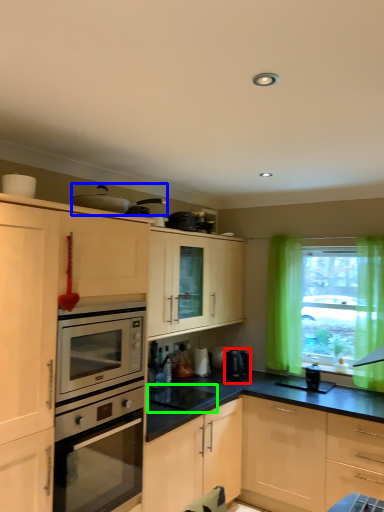
Question: Based on their relative distances, which object is nearer to coffee machine (highlighted by a red box)? Choose from appliance (highlighted by a blue box) and appliance (highlighted by a green box).

Choices:
 (A) appliance
 (B) appliance

Answer: (B)